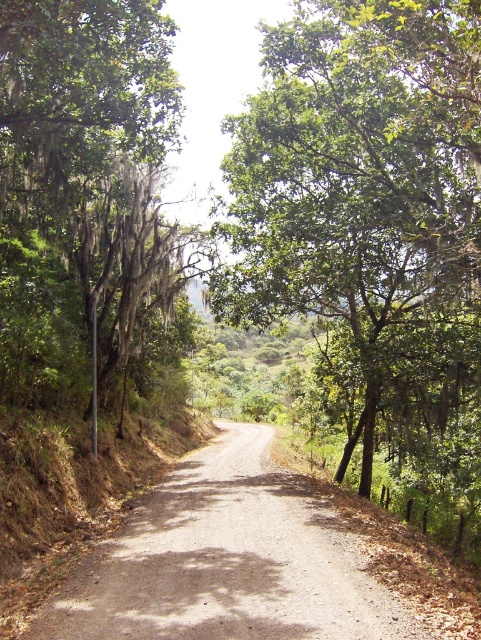
Is green leafy tree at center further to camera compared to dirt/gravel road at center?

Yes.

Does green leafy tree at center have a greater width compared to dirt/gravel road at center?

Indeed, green leafy tree at center has a greater width compared to dirt/gravel road at center.

This screenshot has width=481, height=640. Describe the element at coordinates (356, 170) in the screenshot. I see `green leafy tree at center` at that location.

Where is `green leafy tree at center`? green leafy tree at center is located at coordinates (356, 170).

Who is lower down, green mossy tree at left or dirt/gravel road at center?

Positioned lower is dirt/gravel road at center.

Is point (156, 1) more distant than point (167, 550)?

Yes.

Identify the location of green mossy tree at left. This screenshot has width=481, height=640. (84, 180).

The width and height of the screenshot is (481, 640). Find the location of `green mossy tree at left`. green mossy tree at left is located at coordinates (84, 180).

Does green leafy tree at center have a greater width compared to green mossy tree at left?

Yes.

In the scene shown: Is green leafy tree at center positioned behind green mossy tree at left?

No.

Which is behind, point (337, 97) or point (146, 112)?

Positioned behind is point (337, 97).

Identify the location of green leafy tree at center. (356, 170).